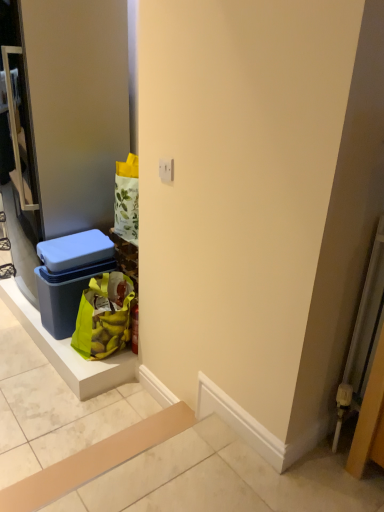
Question: Which is correct: green fabric shopping bag at lower left is inside blue plastic storage box at left, or outside of it?

Choices:
 (A) outside
 (B) inside

Answer: (A)

Question: Considering their positions, is green fabric shopping bag at lower left located in front of or behind blue plastic storage box at left?

Choices:
 (A) front
 (B) behind

Answer: (A)

Question: Which of these objects is positioned farthest from the green fabric shopping bag at lower left?

Choices:
 (A) blue plastic storage box at left
 (B) blue plastic door at left

Answer: (B)

Question: Which is nearer to the blue plastic storage box at left?

Choices:
 (A) green fabric shopping bag at lower left
 (B) blue plastic door at left

Answer: (A)